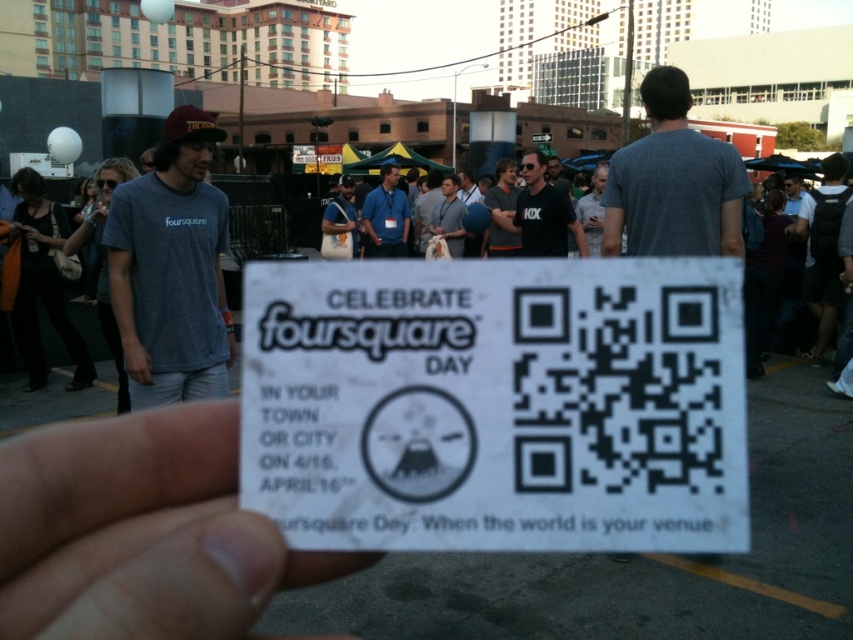
Question: Does white paper qr code at center appear on the right side of black matte shirt at center?

Choices:
 (A) no
 (B) yes

Answer: (A)

Question: Does matte blue t-shirt at left have a lesser width compared to black matte shirt at center?

Choices:
 (A) no
 (B) yes

Answer: (A)

Question: Is white paper at center closer to camera compared to matte blue t-shirt at left?

Choices:
 (A) yes
 (B) no

Answer: (A)

Question: Estimate the real-world distances between objects in this image. Which object is closer to the black matte shirt at center?

Choices:
 (A) white paper qr code at center
 (B) matte blue t-shirt at left

Answer: (B)

Question: Which point is farther from the camera taking this photo?

Choices:
 (A) (119, 426)
 (B) (579, 227)
 (C) (218, 262)

Answer: (B)

Question: Among these points, which one is farthest from the camera?

Choices:
 (A) (537, 250)
 (B) (132, 205)
 (C) (660, 316)

Answer: (A)